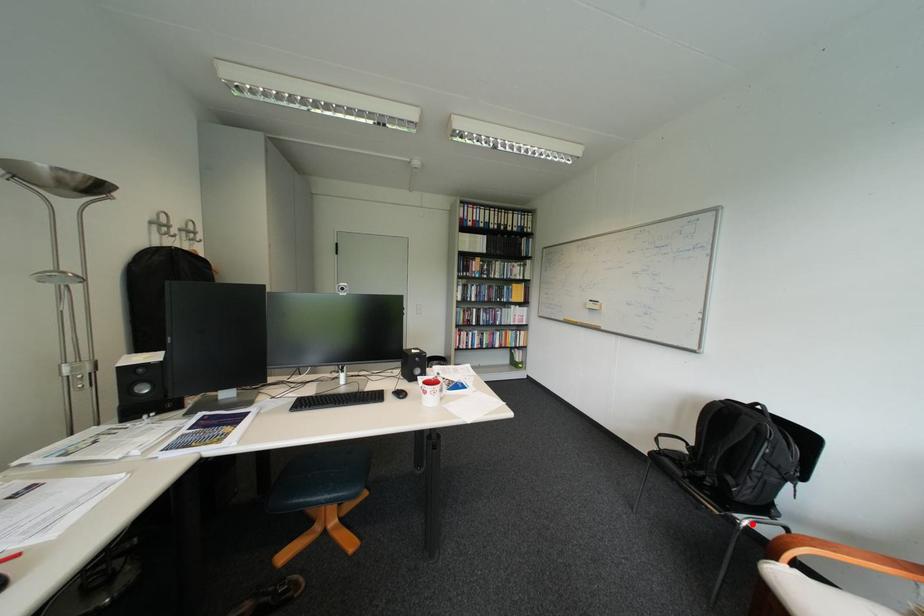
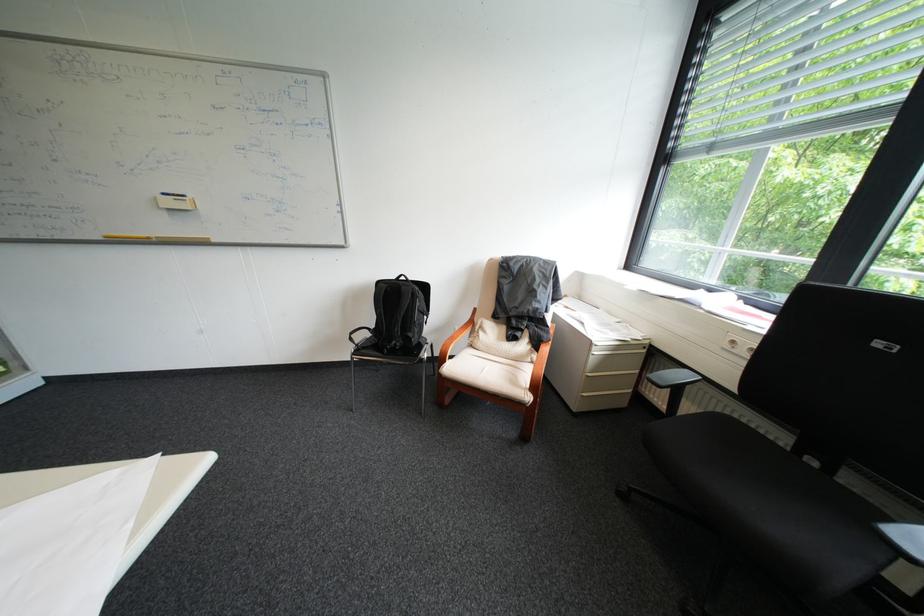
Locate, in the second image, the point that corresponds to the highlighted location in the first image.

(436, 358)